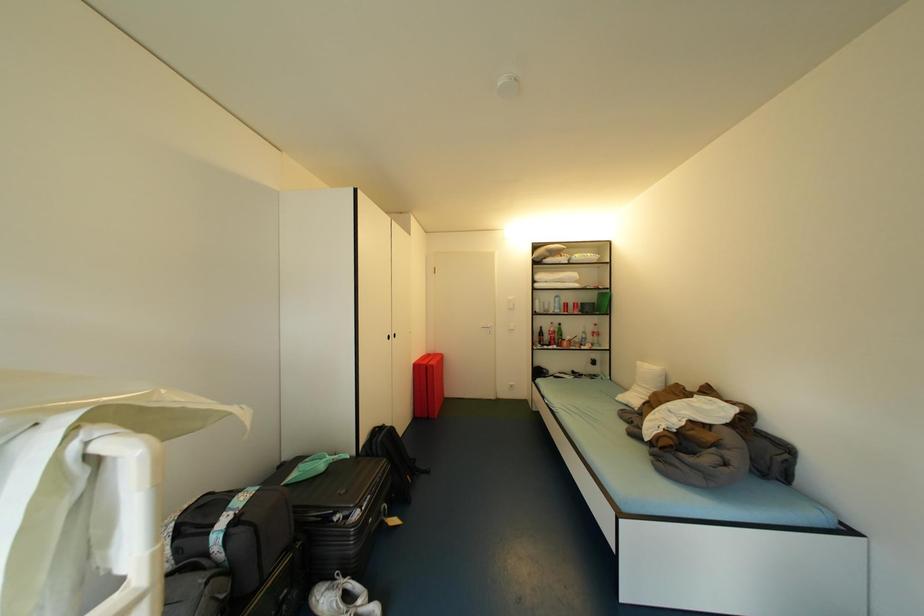
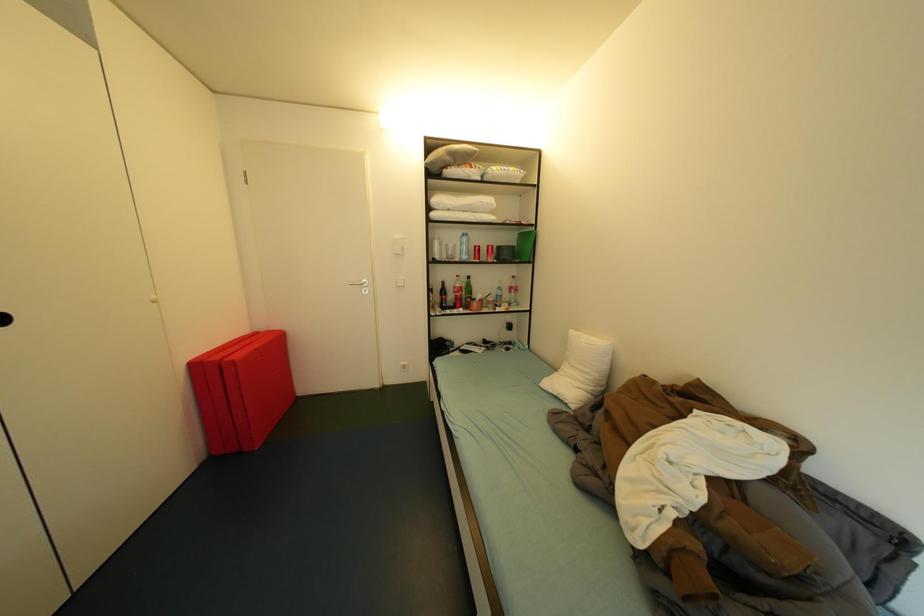
In a continuous first-person perspective shot, in which direction is the camera moving?

The cameraman walked toward right, forward.